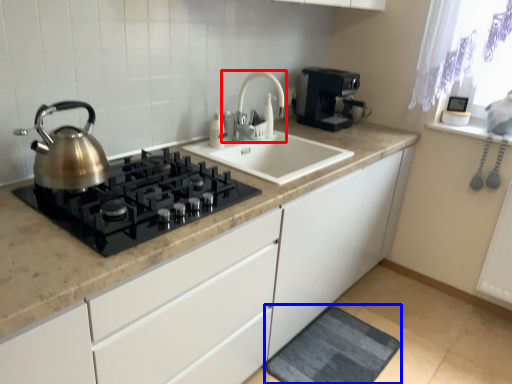
Question: Which of the following is the closest to the observer, tap (highlighted by a red box) or bath mat (highlighted by a blue box)?

Choices:
 (A) tap
 (B) bath mat

Answer: (B)